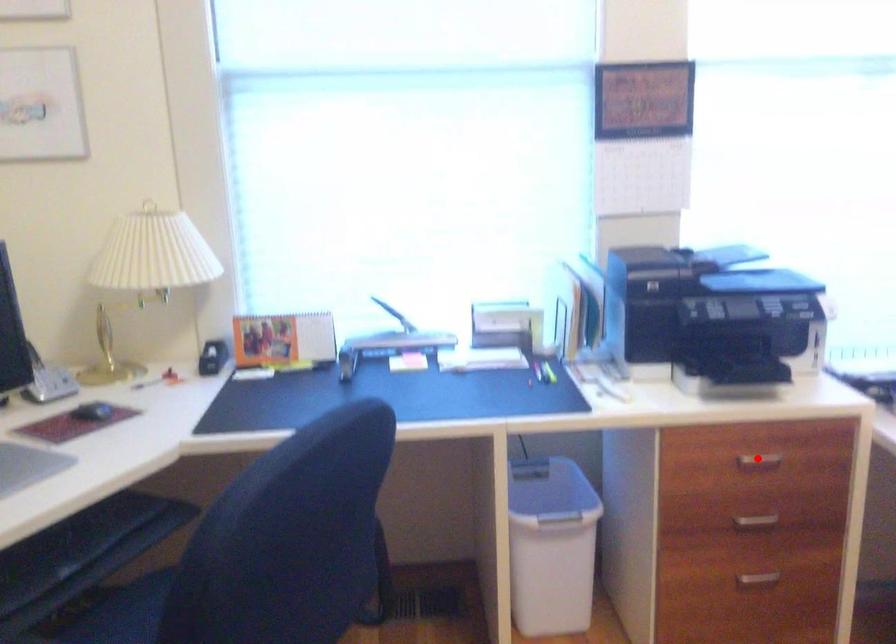
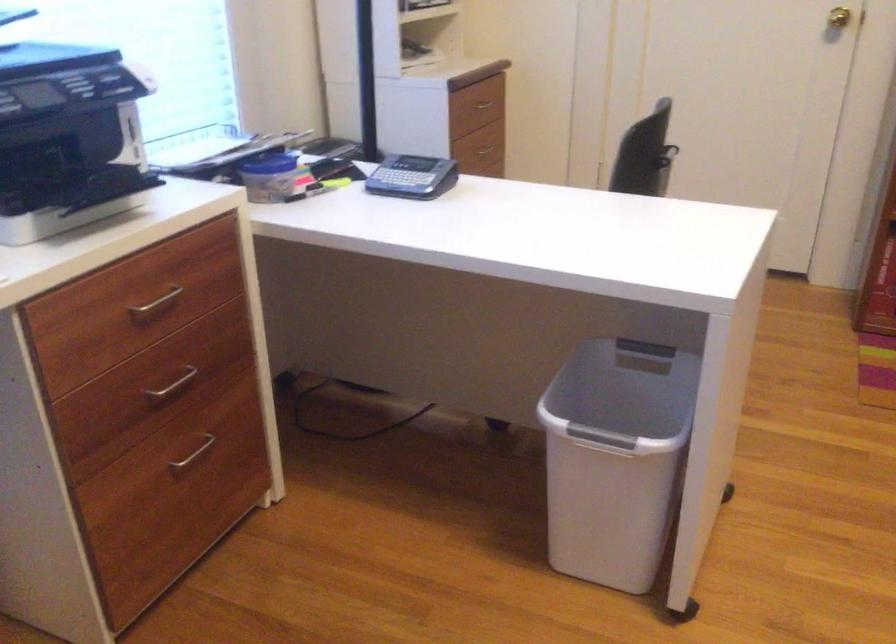
The point at the highlighted location is marked in the first image. Where is the corresponding point in the second image?

(156, 303)